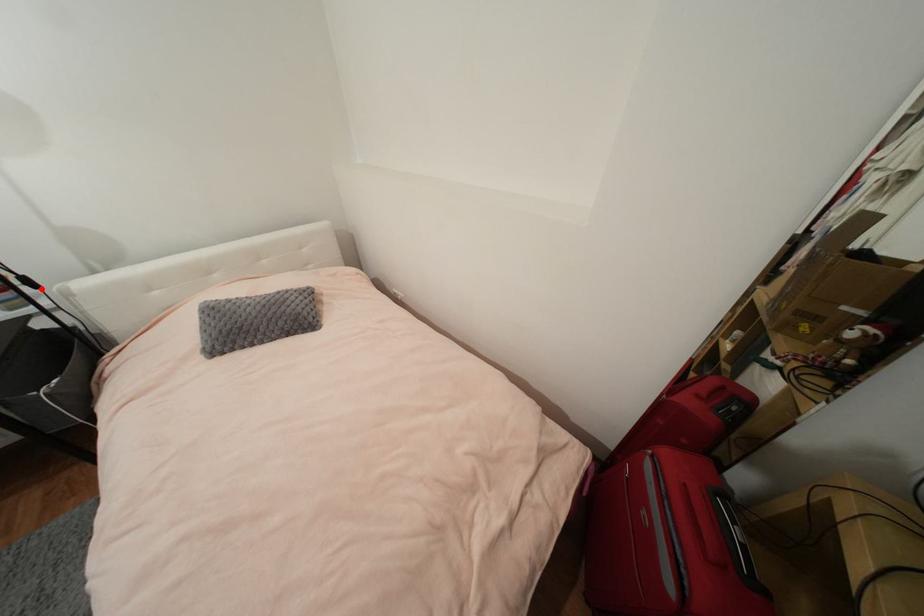
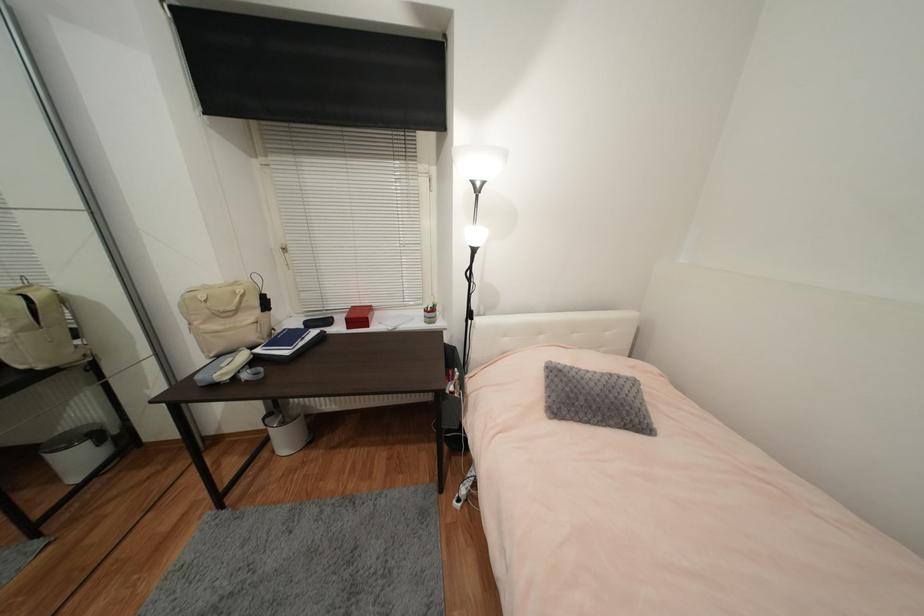
Question: I am providing you with two images of the same scene from different viewpoints. A red point is shown in image1. For the corresponding object point in image2, is it positioned nearer or farther from the camera?

Choices:
 (A) Nearer
 (B) Farther

Answer: (B)